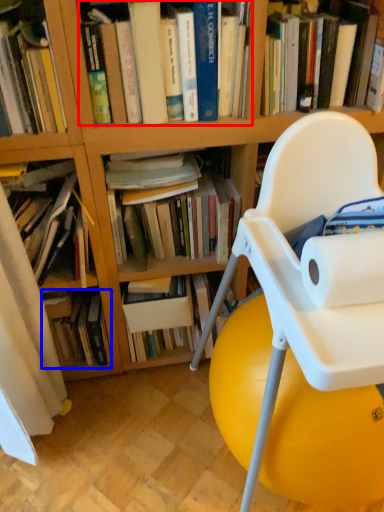
Question: Which object is further to the camera taking this photo, book (highlighted by a red box) or book (highlighted by a blue box)?

Choices:
 (A) book
 (B) book

Answer: (B)